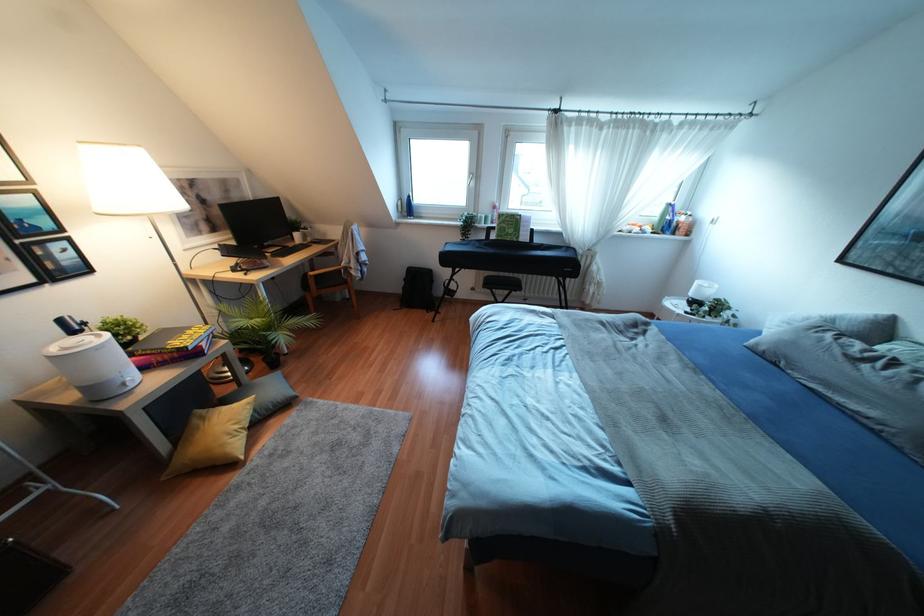
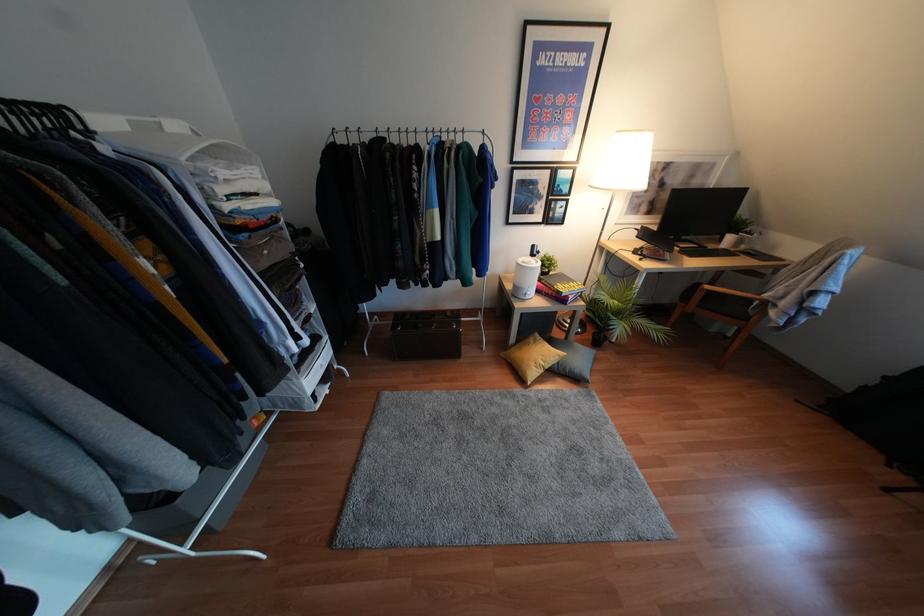
The images are taken continuously from a first-person perspective. In which direction is your viewpoint rotating?

The rotation direction of the camera is left-down.